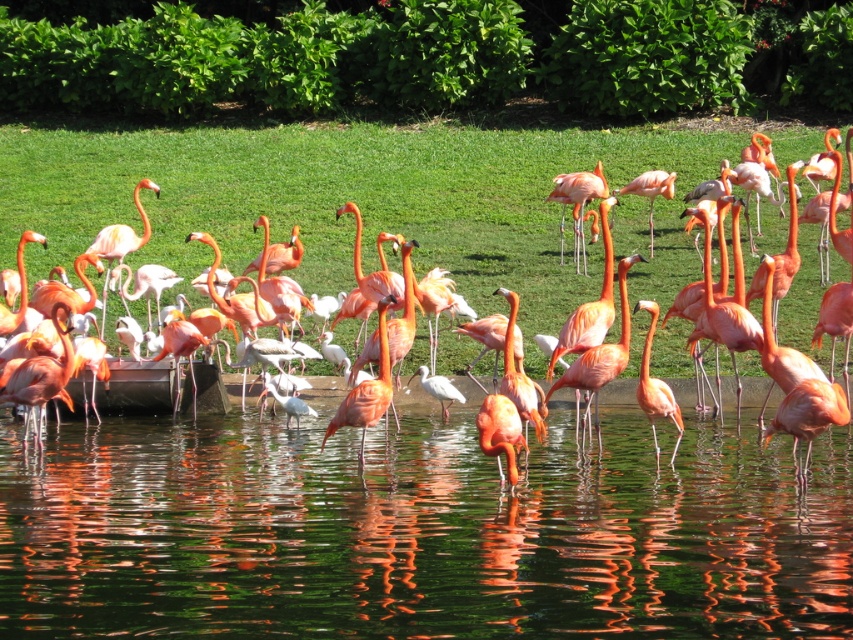
Question: In this image, where is green reflective water at center located relative to pink feathered flamingo at center?

Choices:
 (A) right
 (B) left

Answer: (B)

Question: Which of the following is the farthest from the observer?

Choices:
 (A) pink feathered flamingo at center
 (B) green reflective water at center
 (C) pink matte flamingo at center

Answer: (A)

Question: In this image, where is green reflective water at center located relative to pink matte flamingo at center?

Choices:
 (A) right
 (B) left

Answer: (B)

Question: Estimate the real-world distances between objects in this image. Which object is closer to the pink feathered flamingo at center?

Choices:
 (A) green reflective water at center
 (B) pink matte flamingo at center

Answer: (A)

Question: Which point appears farthest from the camera in this image?

Choices:
 (A) [x=621, y=461]
 (B) [x=653, y=406]
 (C) [x=804, y=321]

Answer: (C)

Question: Considering the relative positions of green reflective water at center and pink matte flamingo at center in the image provided, where is green reflective water at center located with respect to pink matte flamingo at center?

Choices:
 (A) above
 (B) below

Answer: (B)